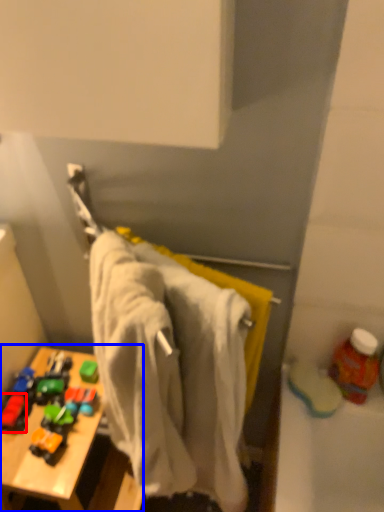
Question: Among these objects, which one is farthest to the camera, toy (highlighted by a red box) or table (highlighted by a blue box)?

Choices:
 (A) toy
 (B) table

Answer: (A)